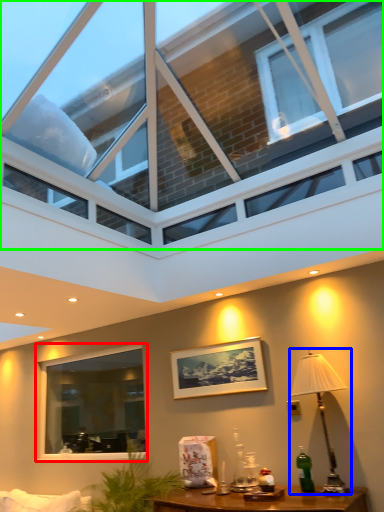
Question: Which is nearer to the window (highlighted by a red box)? table lamp (highlighted by a blue box) or window (highlighted by a green box).

Choices:
 (A) table lamp
 (B) window

Answer: (A)